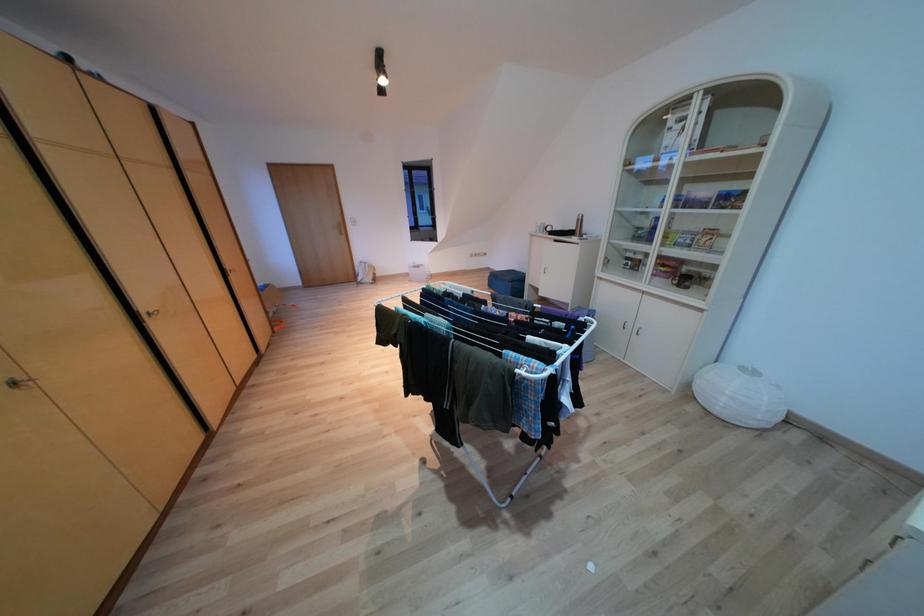
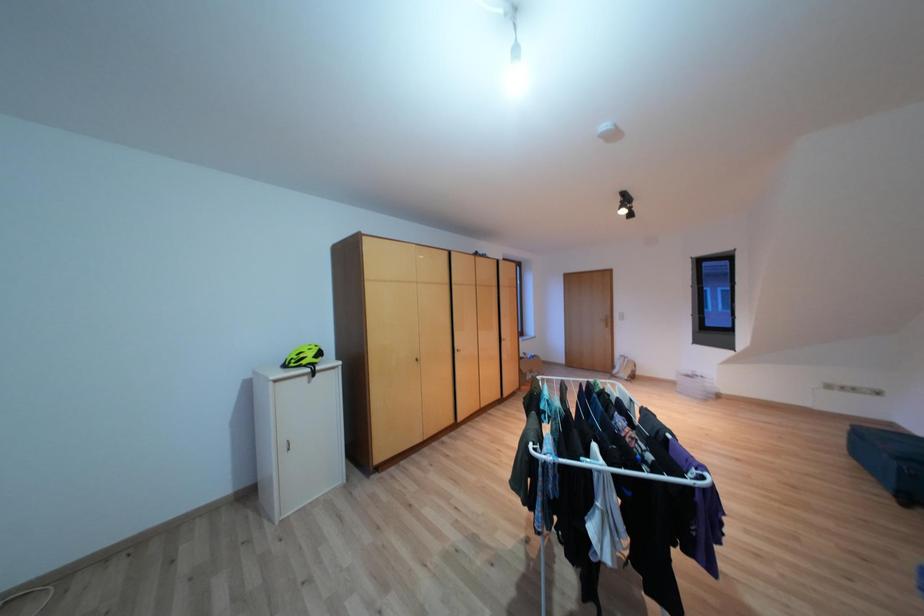
Question: The camera is either moving clockwise (left) or counter-clockwise (right) around the object. The first image is from the beginning of the video and the second image is from the end. Is the camera moving left or right when shooting the video?

Choices:
 (A) Left
 (B) Right

Answer: (B)